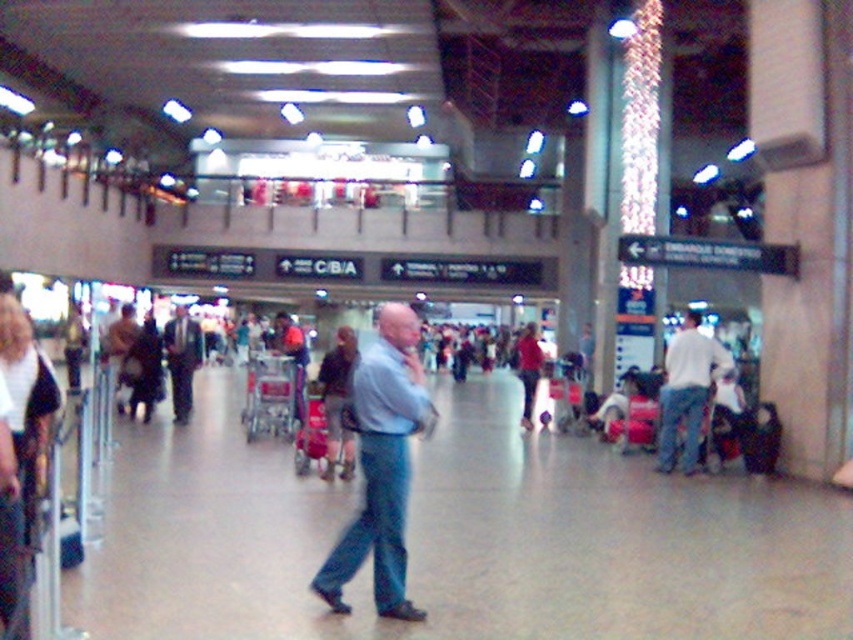
From the picture: Is dark gray sweater at center taller than matte black suitcase at lower right?

Yes, dark gray sweater at center is taller than matte black suitcase at lower right.

Is dark gray sweater at center above matte black suitcase at lower right?

Indeed, dark gray sweater at center is positioned over matte black suitcase at lower right.

Measure the distance between point (350, 440) and camera.

Point (350, 440) and camera are 9.67 meters apart from each other.

The height and width of the screenshot is (640, 853). I want to click on dark gray sweater at center, so click(337, 401).

Does white cotton shirt at center appear over dark gray sweater at center?

Indeed, white cotton shirt at center is positioned over dark gray sweater at center.

Does point (672, 380) come in front of point (322, 356)?

Yes, it is.

Where is `white cotton shirt at center`? This screenshot has width=853, height=640. white cotton shirt at center is located at coordinates (688, 392).

Is point (386, 609) less distant than point (335, 397)?

Yes, it is.

Can you confirm if blue denim jeans at center is wider than dark gray sweater at center?

No, blue denim jeans at center is not wider than dark gray sweater at center.

Who is more distant from viewer, [373,548] or [320,384]?

The point [320,384] is more distant.

Locate an element on the screen. The height and width of the screenshot is (640, 853). blue denim jeans at center is located at coordinates (373, 528).